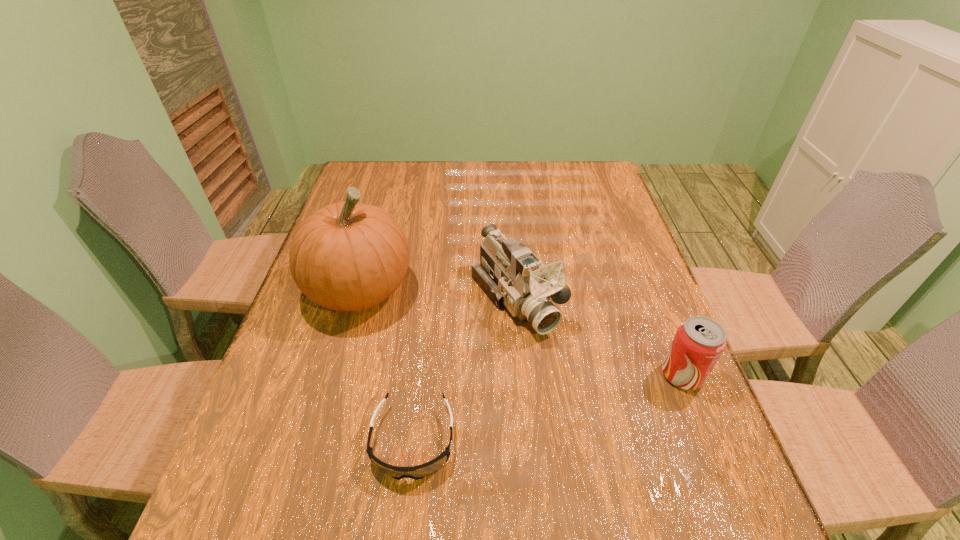
Identify the location of goggles. (421, 471).

What are the coordinates of `the nearest object` in the screenshot? It's located at (421, 471).

The width and height of the screenshot is (960, 540). Identify the location of the third farthest object. (699, 341).

Identify the location of soda can. This screenshot has width=960, height=540. (699, 341).

I want to click on camcorder, so click(x=512, y=276).

At what (x,y) coordinates should I click in order to perform the action: click on the third object from left to right. Please return your answer as a coordinate pair (x, y). The height and width of the screenshot is (540, 960). Looking at the image, I should click on (512, 276).

In order to click on pumpkin in this screenshot , I will do `click(347, 256)`.

At what (x,y) coordinates should I click in order to perform the action: click on free space located on the left of the soda can. Please return your answer as a coordinate pair (x, y). Looking at the image, I should click on (543, 375).

Find the location of a particular element. The width and height of the screenshot is (960, 540). vacant space located on the front-facing side of the third object from left to right is located at coordinates (616, 430).

At what (x,y) coordinates should I click in order to perform the action: click on free space located on the front-facing side of the third object from left to right. Please return your answer as a coordinate pair (x, y). This screenshot has width=960, height=540. Looking at the image, I should click on (555, 354).